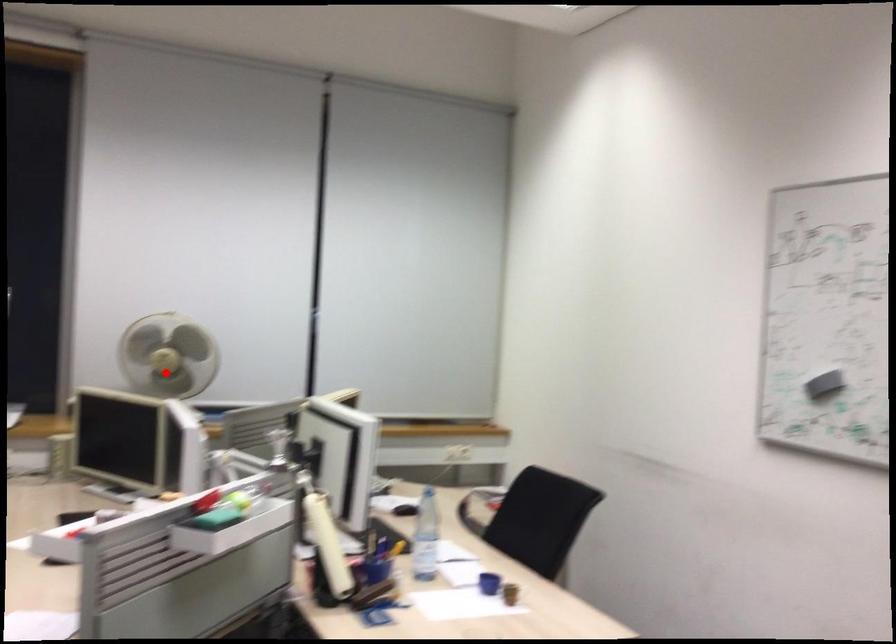
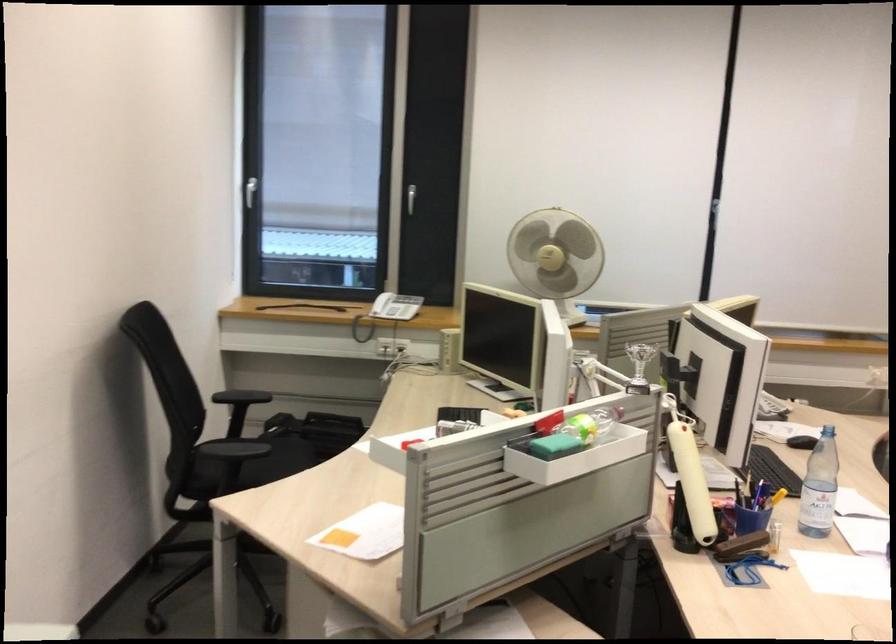
In the second image, find the point that corresponds to the highlighted location in the first image.

(556, 257)